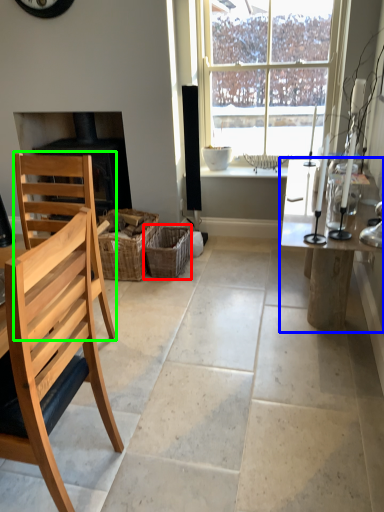
Question: Which object is positioned farthest from crate (highlighted by a red box)? Select from table (highlighted by a blue box) and chair (highlighted by a green box).

Choices:
 (A) table
 (B) chair

Answer: (A)